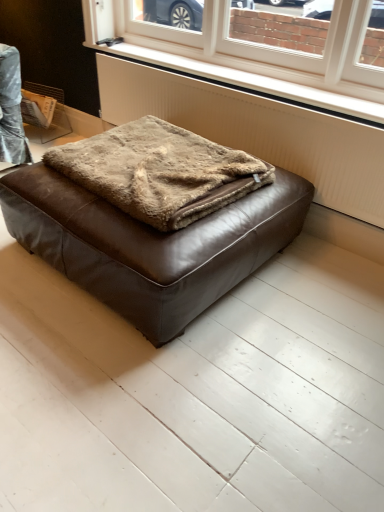
You are a GUI agent. You are given a task and a screenshot of the screen. Output one action in this format:
    pyautogui.click(x=<x>, y=<y>)
    Task: Click on the brown fuzzy blanket at center
    The height and width of the screenshot is (512, 384).
    Given the screenshot: What is the action you would take?
    pyautogui.click(x=160, y=170)

What do you see at coordinates (257, 131) in the screenshot? Image resolution: width=384 pixels, height=512 pixels. I see `white textured radiator at center` at bounding box center [257, 131].

What is the approximate height of white textured radiator at lower center?

white textured radiator at lower center is 2.07 inches tall.

The height and width of the screenshot is (512, 384). What are the coordinates of `brown leather ottoman at center` in the screenshot? It's located at (150, 245).

Considering the positions of objects white textured radiator at center and white textured radiator at lower center in the image provided, who is behind, white textured radiator at center or white textured radiator at lower center?

Positioned behind is white textured radiator at lower center.

From the image's perspective, between white textured radiator at center and white textured radiator at lower center, who is located below?

white textured radiator at center, from the image's perspective.

In the scene shown: Considering the sizes of objects white textured radiator at center and white textured radiator at lower center in the image provided, who is bigger, white textured radiator at center or white textured radiator at lower center?

white textured radiator at center.

Choose the correct answer: Is white textured radiator at center inside white textured radiator at lower center or outside it?

white textured radiator at center lies outside white textured radiator at lower center.

Is the position of brown leather ottoman at center more distant than that of white textured radiator at center?

No, brown leather ottoman at center is in front of white textured radiator at center.

From the picture: Is brown leather ottoman at center inside the boundaries of white textured radiator at center, or outside?

brown leather ottoman at center lies outside white textured radiator at center.

Is brown leather ottoman at center next to white textured radiator at center?

No, brown leather ottoman at center is not beside white textured radiator at center.

From the image's perspective, is white textured radiator at center below white plastic window at upper center?

Correct, white textured radiator at center appears lower than white plastic window at upper center in the image.

In the scene shown: Considering the relative positions of white textured radiator at center and white plastic window at upper center in the image provided, is white textured radiator at center to the left of white plastic window at upper center from the viewer's perspective?

Incorrect, white textured radiator at center is not on the left side of white plastic window at upper center.

Looking at the image, does white textured radiator at center seem bigger or smaller compared to white plastic window at upper center?

Considering their sizes, white textured radiator at center takes up more space than white plastic window at upper center.

Which of these two, white textured radiator at center or white plastic window at upper center, stands taller?

Standing taller between the two is white textured radiator at center.

I want to click on window on the left of white textured radiator at lower center, so click(247, 52).

Is white plastic window at upper center to the left or to the right of white textured radiator at lower center in the image?

white plastic window at upper center is to the left of white textured radiator at lower center.

Would you consider white plastic window at upper center to be distant from white textured radiator at lower center?

That's not correct — white plastic window at upper center is a little close to white textured radiator at lower center.

Is white plastic window at upper center bigger than white textured radiator at lower center?

Indeed, white plastic window at upper center has a larger size compared to white textured radiator at lower center.

From a real-world perspective, which object stands above the other?

From a 3D spatial view, white plastic window at upper center is above.

Which point is more forward, [226,1] or [94,255]?

The point [94,255] is closer to the camera.

Considering the sizes of white plastic window at upper center and brown leather ottoman at center in the image, is white plastic window at upper center wider or thinner than brown leather ottoman at center?

Considering their sizes, white plastic window at upper center looks slimmer than brown leather ottoman at center.

Does white plastic window at upper center contain brown leather ottoman at center?

No.

Does brown fuzzy blanket at center have a greater height compared to brown leather ottoman at center?

No, brown fuzzy blanket at center is not taller than brown leather ottoman at center.

Locate an element on the screen. The width and height of the screenshot is (384, 512). furniture that appears on the right of brown fuzzy blanket at center is located at coordinates (150, 245).

From a real-world perspective, is brown fuzzy blanket at center above or below brown leather ottoman at center?

Clearly, from a real-world perspective, brown fuzzy blanket at center is above brown leather ottoman at center.

From the image's perspective, is brown fuzzy blanket at center located above or below brown leather ottoman at center?

Based on their image positions, brown fuzzy blanket at center is located above brown leather ottoman at center.

From the image's perspective, would you say white plastic window at upper center is positioned over white textured radiator at center?

Yes, from the image's perspective, white plastic window at upper center is over white textured radiator at center.

Is white plastic window at upper center far away from white textured radiator at center?

That's not correct — white plastic window at upper center is a little close to white textured radiator at center.

Which object is positioned more to the right, white plastic window at upper center or white textured radiator at center?

Positioned to the right is white textured radiator at center.

From the picture: From a real-world perspective, relative to white textured radiator at center, is white plastic window at upper center vertically above or below?

white plastic window at upper center is above white textured radiator at center.

Find the location of a particular element. Image resolution: width=384 pixels, height=512 pixels. window sill that appears above the white textured radiator at center (from the image's perspective) is located at coordinates (252, 83).

Identify the location of furniture in front of the white textured radiator at center. (150, 245).

From the image, which object appears to be nearer to white plastic window at upper center, white textured radiator at lower center or white textured radiator at center?

Among the two, white textured radiator at lower center is located nearer to white plastic window at upper center.

Estimate the real-world distances between objects in this image. Which object is further from white textured radiator at lower center, brown fuzzy blanket at center or brown leather ottoman at center?

brown leather ottoman at center is positioned further to the anchor white textured radiator at lower center.

Estimate the real-world distances between objects in this image. Which object is further from white textured radiator at center, brown leather ottoman at center or white plastic window at upper center?

The object further to white textured radiator at center is brown leather ottoman at center.

Which object lies further to the anchor point brown fuzzy blanket at center, brown leather ottoman at center or white textured radiator at lower center?

white textured radiator at lower center is positioned further to the anchor brown fuzzy blanket at center.

Estimate the real-world distances between objects in this image. Which object is further from white plastic window at upper center, brown leather ottoman at center or brown fuzzy blanket at center?

brown leather ottoman at center is further to white plastic window at upper center.

Which object lies nearer to the anchor point brown leather ottoman at center, brown fuzzy blanket at center or white textured radiator at lower center?

brown fuzzy blanket at center lies closer to brown leather ottoman at center than the other object.

Looking at the image, which one is located closer to brown fuzzy blanket at center, white plastic window at upper center or white textured radiator at center?

Based on the image, white textured radiator at center appears to be nearer to brown fuzzy blanket at center.

Based on the photo, based on their spatial positions, is white textured radiator at lower center or white plastic window at upper center closer to brown fuzzy blanket at center?

white textured radiator at lower center.

This screenshot has width=384, height=512. What are the coordinates of `radiator between white plastic window at upper center and brown leather ottoman at center in the vertical direction` in the screenshot? It's located at (257, 131).

Where is `window sill between white plastic window at upper center and white textured radiator at center in the up-down direction`? window sill between white plastic window at upper center and white textured radiator at center in the up-down direction is located at coordinates coord(252,83).

I want to click on radiator between white textured radiator at lower center and brown leather ottoman at center from top to bottom, so click(x=257, y=131).

Find the location of a particular element. The height and width of the screenshot is (512, 384). radiator that lies between white plastic window at upper center and brown fuzzy blanket at center from top to bottom is located at coordinates (257, 131).